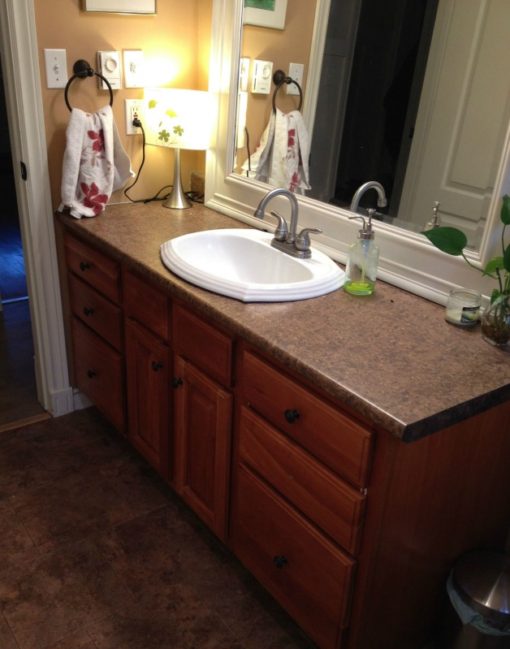
Identify the location of drawersdoors. This screenshot has width=510, height=649. (306, 589), (315, 502), (327, 454), (94, 282), (94, 311), (99, 365), (196, 471), (152, 437).